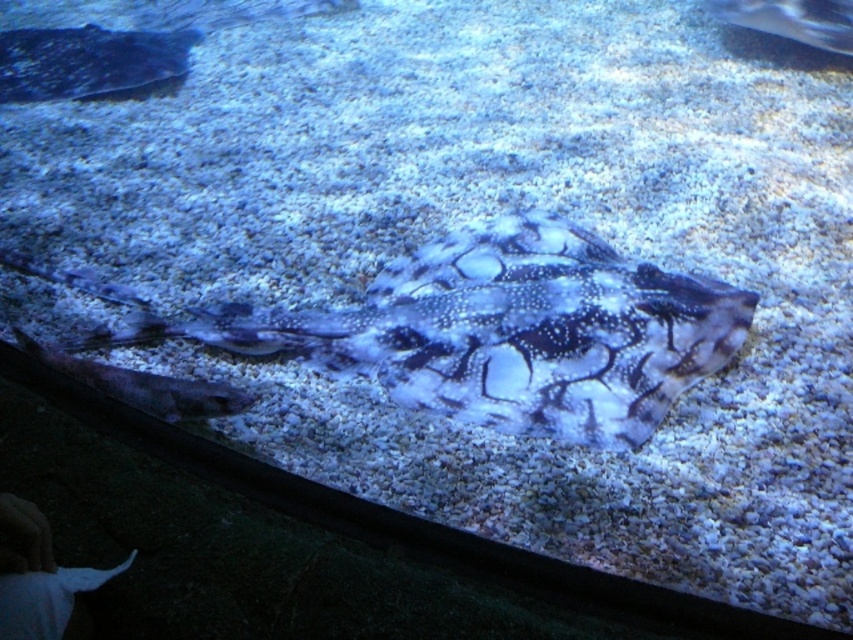
From the picture: Does speckled skin fish at center appear on the left side of speckled skin ray at upper right?

Indeed, speckled skin fish at center is positioned on the left side of speckled skin ray at upper right.

Between speckled skin fish at center and speckled skin ray at upper right, which one has more height?

speckled skin ray at upper right is taller.

Between point (73, 372) and point (822, 32), which one is positioned in front?

Point (73, 372) is in front.

Identify the location of speckled skin fish at center. This screenshot has width=853, height=640. (144, 385).

Based on the photo, does speckled skin ray at center have a greater width compared to speckled skin ray at upper right?

Correct, the width of speckled skin ray at center exceeds that of speckled skin ray at upper right.

Does speckled skin ray at center have a smaller size compared to speckled skin ray at upper right?

No.

Image resolution: width=853 pixels, height=640 pixels. What are the coordinates of `speckled skin ray at center` in the screenshot? It's located at (502, 332).

Locate an element on the screen. speckled skin ray at center is located at coordinates (502, 332).

Is speckled skin ray at center thinner than speckled skin fish at center?

Incorrect, speckled skin ray at center's width is not less than speckled skin fish at center's.

Between point (289, 337) and point (105, 376), which one is positioned behind?

The point (289, 337) is behind.

Find the location of a particular element. The width and height of the screenshot is (853, 640). speckled skin ray at center is located at coordinates (502, 332).